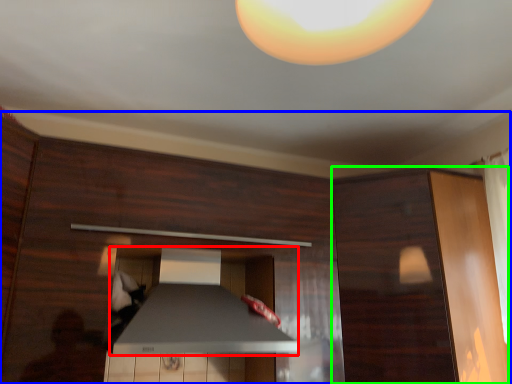
Question: Estimate the real-world distances between objects in this image. Which object is farther from exhaust hood (highlighted by a red box), dresser (highlighted by a blue box) or cabinetry (highlighted by a green box)?

Choices:
 (A) dresser
 (B) cabinetry

Answer: (B)